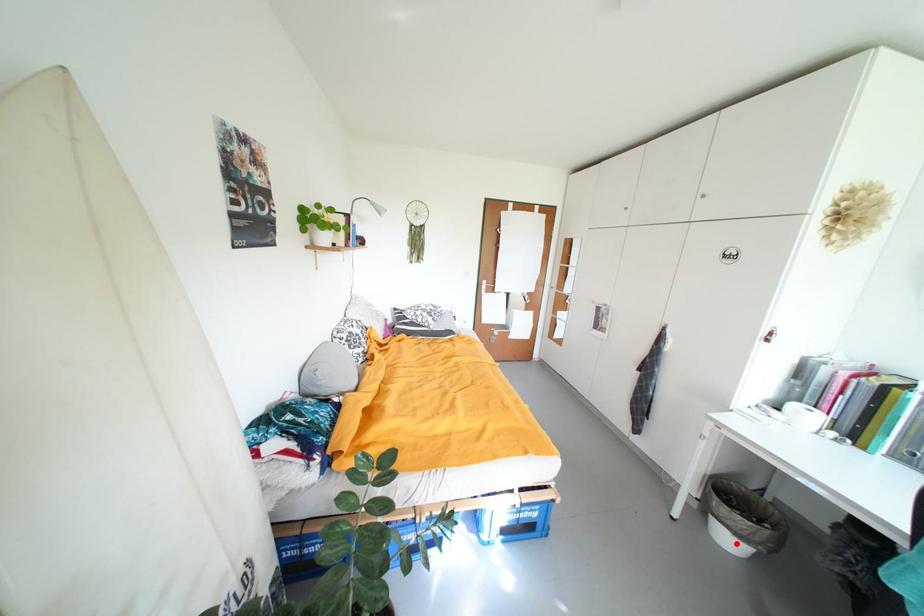
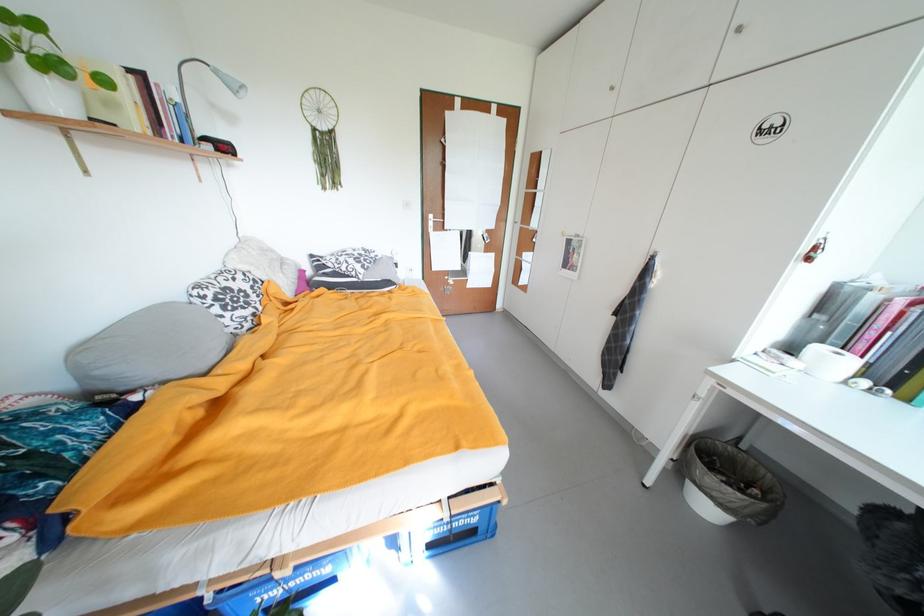
The point at the highlighted location is marked in the first image. Where is the corresponding point in the second image?

(714, 509)